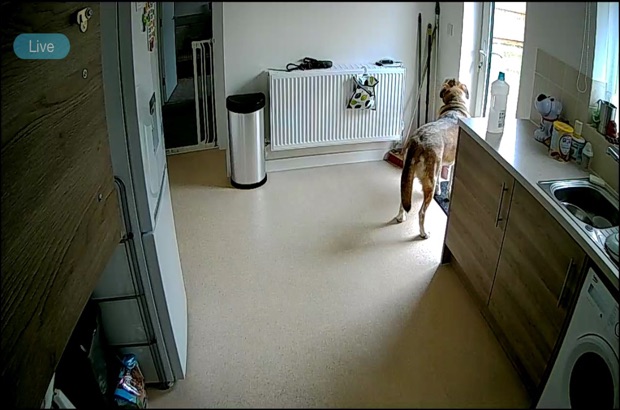
You are a GUI agent. You are given a task and a screenshot of the screen. Output one action in this format:
    pyautogui.click(x=<x>, y=<y>)
    Task: Click on the door
    The width and height of the screenshot is (620, 410).
    Given the screenshot: What is the action you would take?
    pyautogui.click(x=503, y=45)